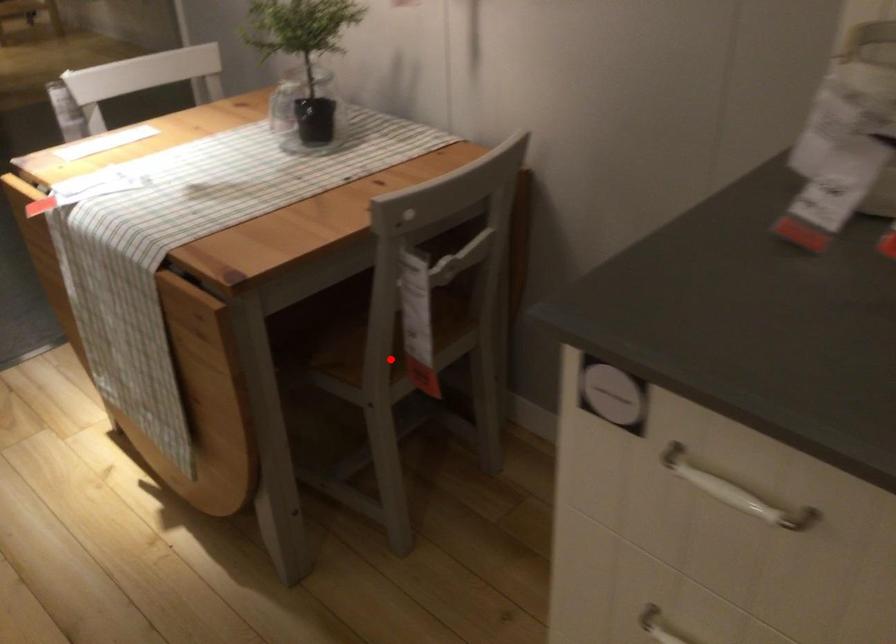
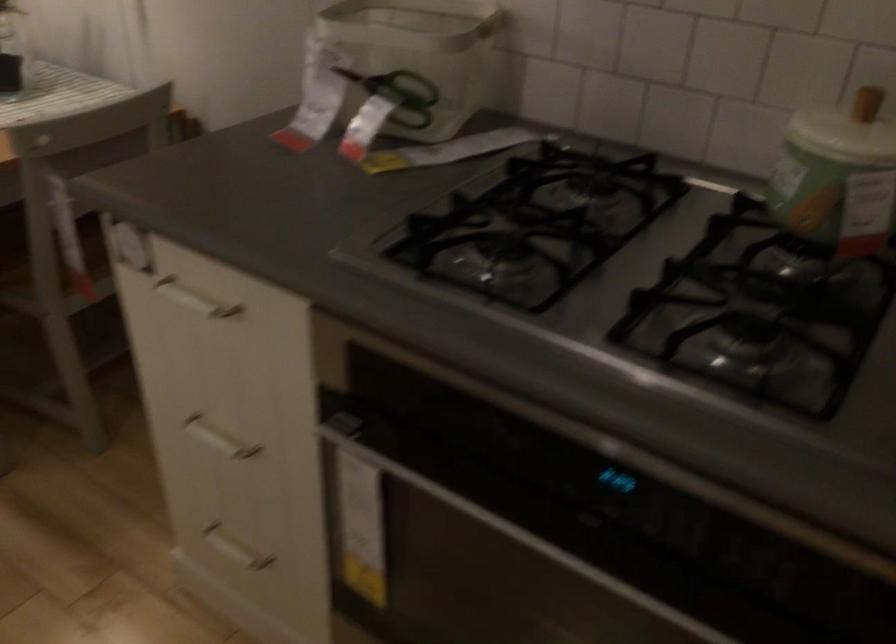
Locate, in the second image, the point that corresponds to the highlighted location in the first image.

(54, 270)